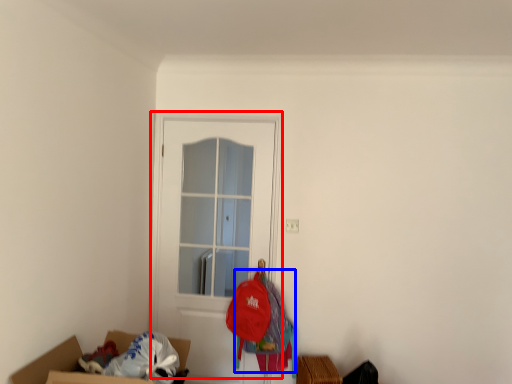
Question: Among these objects, which one is farthest to the camera, door (highlighted by a red box) or clothing (highlighted by a blue box)?

Choices:
 (A) door
 (B) clothing

Answer: (A)